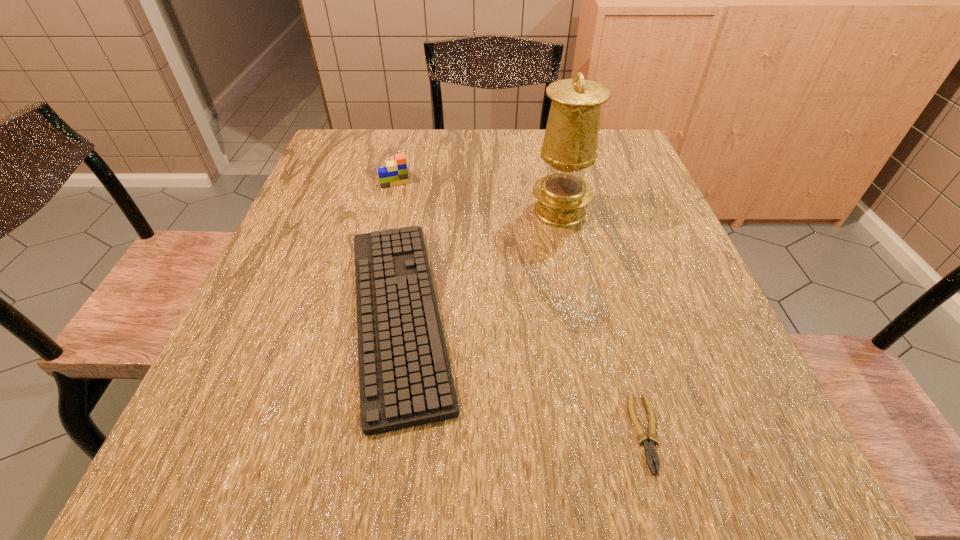
Where is `free space between the shortest object and the third tallest object`? This screenshot has width=960, height=540. free space between the shortest object and the third tallest object is located at coordinates (522, 374).

Find the location of a particular element. The height and width of the screenshot is (540, 960). vacant region between the shortest object and the farthest object is located at coordinates (521, 303).

The height and width of the screenshot is (540, 960). In order to click on free space that is in between the third nearest object and the second tallest object in this screenshot , I will do (x=477, y=193).

Where is `free space between the pliers and the tallest object`? The width and height of the screenshot is (960, 540). free space between the pliers and the tallest object is located at coordinates (603, 323).

In order to click on free point between the third tallest object and the pliers in this screenshot , I will do `click(522, 374)`.

Where is `object identified as the closest to the pliers`? This screenshot has height=540, width=960. object identified as the closest to the pliers is located at coordinates (405, 379).

Locate an element on the screen. This screenshot has height=540, width=960. the second closest object to the second shortest object is located at coordinates (395, 173).

Locate an element on the screen. The width and height of the screenshot is (960, 540). free space that satisfies the following two spatial constraints: 1. on the front side of the farthest object; 2. on the right side of the second farthest object is located at coordinates tap(386, 212).

This screenshot has width=960, height=540. Find the location of `free space that satisfies the following two spatial constraints: 1. on the front side of the second tallest object; 2. on the left side of the tallest object`. free space that satisfies the following two spatial constraints: 1. on the front side of the second tallest object; 2. on the left side of the tallest object is located at coordinates (386, 212).

I want to click on vacant space that satisfies the following two spatial constraints: 1. on the front side of the third shortest object; 2. on the left side of the shortest object, so click(330, 434).